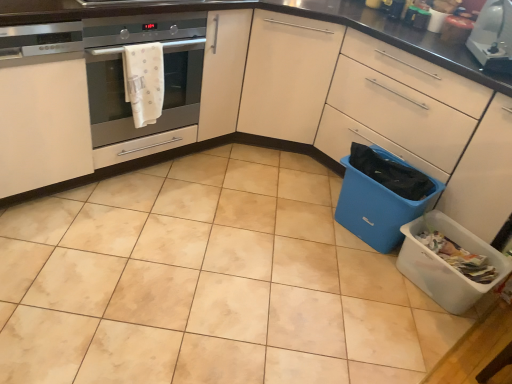
Question: From a real-world perspective, is white matte cabinet at left, marked as the second cabinetry in a right-to-left arrangement, physically located above or below white fabric towel at left, the 1th material positioned from the top?

Choices:
 (A) below
 (B) above

Answer: (A)

Question: Considering the positions of white matte cabinet at left, acting as the first cabinetry starting from the left, and white fabric towel at left, the 1th material positioned from the top, in the image, is white matte cabinet at left, acting as the first cabinetry starting from the left, wider or thinner than white fabric towel at left, the 1th material positioned from the top,?

Choices:
 (A) thin
 (B) wide

Answer: (B)

Question: Which of these objects is positioned closest to the white fabric towel at left, which appears as the first material when viewed from the left?

Choices:
 (A) blue plastic bin at lower right, which is the 2th material in top-to-bottom order
 (B) white glossy toaster at upper right
 (C) white matte cabinet at left, acting as the first cabinetry starting from the left
 (D) beige glossy tile at center
 (E) matte white cabinet at center, the 1th cabinetry viewed from the right

Answer: (C)

Question: Estimate the real-world distances between objects in this image. Which object is closer to the white fabric towel at left, which is counted as the 2th material, starting from the right?

Choices:
 (A) white glossy toaster at upper right
 (B) white plastic recycling bin at lower right, positioned as the 2th recycling bin in top-to-bottom order
 (C) satin silver oven at left
 (D) matte white cabinet at center, which is the 2th cabinetry from left to right
 (E) beige glossy tile at center

Answer: (C)